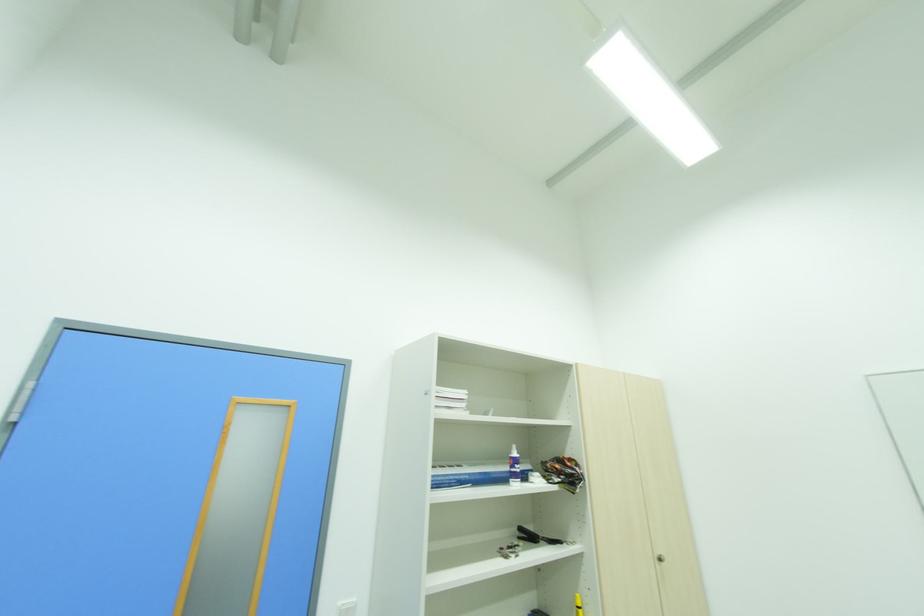
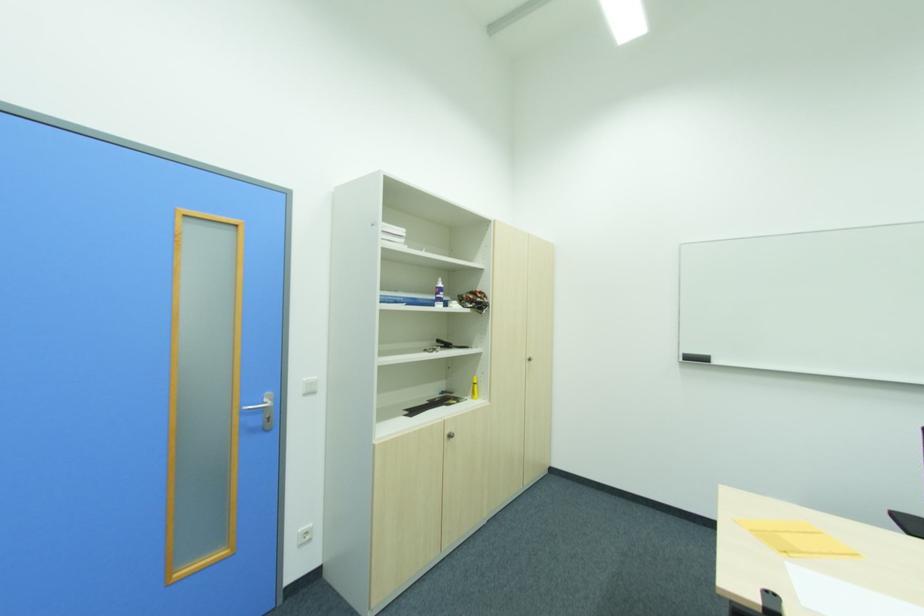
First-person continuous shooting, in which direction is the camera rotating?

The camera rotated toward right-down.